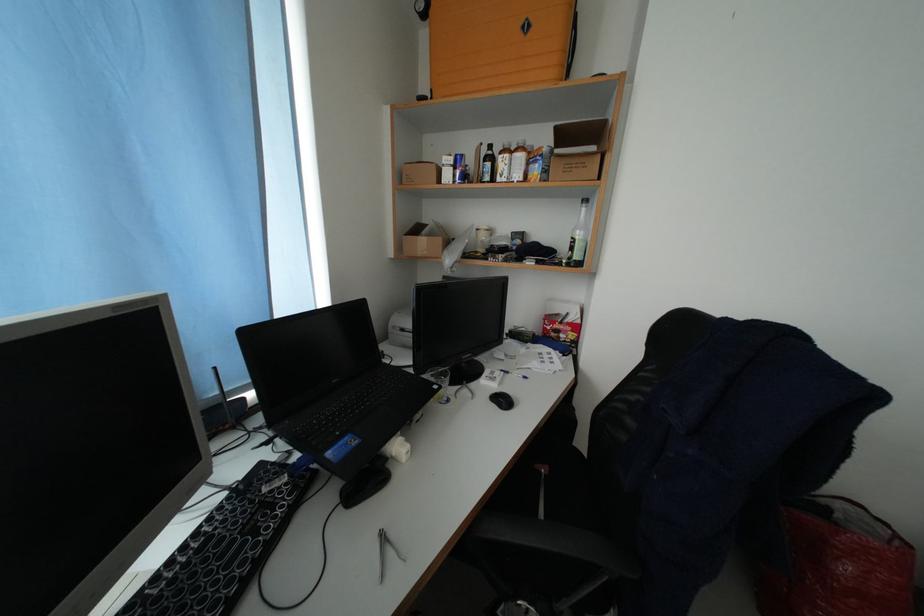
You are a GUI agent. You are given a task and a screenshot of the screen. Output one action in this format:
    pyautogui.click(x=<x>, y=<y>)
    Task: Click on the black box handle
    Image resolution: width=924 pixels, height=616 pixels.
    Given the screenshot: What is the action you would take?
    pyautogui.click(x=580, y=169)